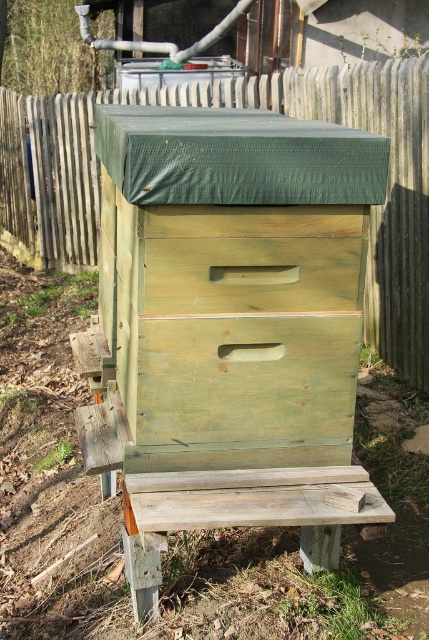
Question: Is weathered wood fence at upper center positioned at the back of weathered wood bench at lower center?

Choices:
 (A) no
 (B) yes

Answer: (B)

Question: Which of the following is the closest to the observer?

Choices:
 (A) weathered wood fence at upper center
 (B) weathered wood bench at lower center

Answer: (B)

Question: Can you confirm if weathered wood fence at upper center is positioned to the left of weathered wood bench at lower center?

Choices:
 (A) no
 (B) yes

Answer: (B)

Question: Which point is farther to the camera?

Choices:
 (A) pyautogui.click(x=204, y=492)
 (B) pyautogui.click(x=337, y=106)

Answer: (B)

Question: Does weathered wood fence at upper center have a lesser width compared to weathered wood bench at lower center?

Choices:
 (A) no
 (B) yes

Answer: (A)